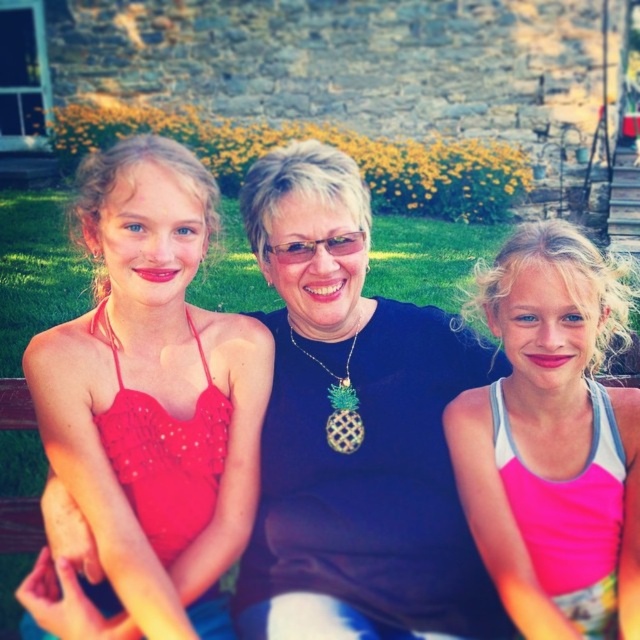
Describe the element at coordinates (154, 394) in the screenshot. I see `matte red dress at left` at that location.

Can you confirm if matte red dress at left is thinner than pink fabric tank top at center?

Correct, matte red dress at left's width is less than pink fabric tank top at center's.

Measure the distance between point [250,371] and camera.

They are 9.21 meters apart.

Find the location of a particular element. matte red dress at left is located at coordinates (154, 394).